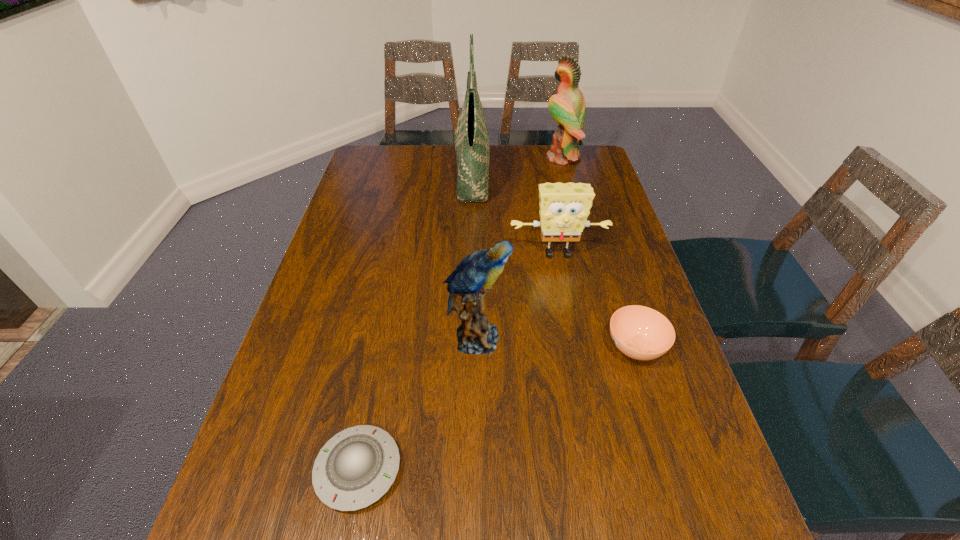
Locate an element on the screen. vacant region that satisfies the following two spatial constraints: 1. on the front-facing side of the fifth shortest object; 2. on the face of the fourth tallest object is located at coordinates (588, 253).

In order to click on free space that satisfies the following two spatial constraints: 1. on the front-facing side of the taller parrot; 2. on the back side of the fifth tallest object in this screenshot , I will do `click(612, 347)`.

You are a GUI agent. You are given a task and a screenshot of the screen. Output one action in this format:
    pyautogui.click(x=<x>, y=<y>)
    Task: Click on the free point that satisfies the following two spatial constraints: 1. on the face of the third shortest object; 2. on the face of the left parrot
    The height and width of the screenshot is (540, 960).
    Given the screenshot: What is the action you would take?
    pyautogui.click(x=574, y=339)

Where is `blank area in the image that satisfies the following two spatial constraints: 1. on the front-facing side of the taller parrot; 2. on the face of the third farthest object`? blank area in the image that satisfies the following two spatial constraints: 1. on the front-facing side of the taller parrot; 2. on the face of the third farthest object is located at coordinates (588, 253).

The width and height of the screenshot is (960, 540). I want to click on free region that satisfies the following two spatial constraints: 1. on the back side of the soup bowl; 2. on the front-facing side of the farther parrot, so click(576, 158).

Locate an element on the screen. This screenshot has height=540, width=960. vacant space that satisfies the following two spatial constraints: 1. on the face of the third tallest object; 2. on the front side of the shortest object is located at coordinates (475, 469).